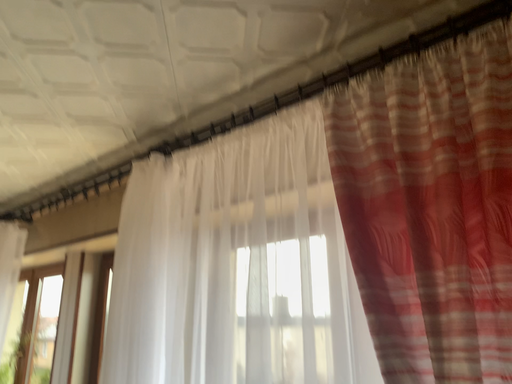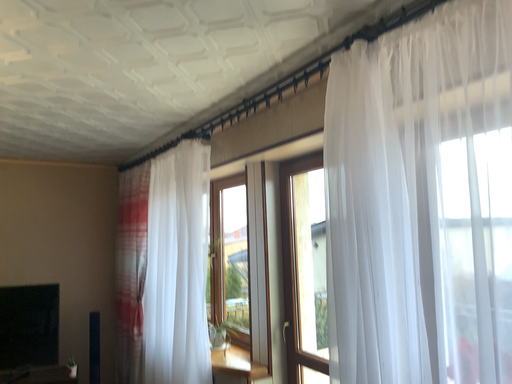
Question: Which way did the camera rotate in the video?

Choices:
 (A) rotated left
 (B) rotated right

Answer: (A)